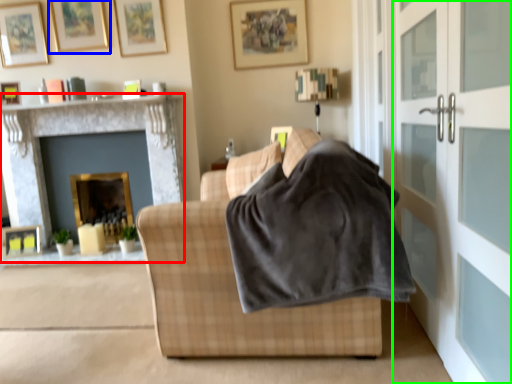
Question: Which object is positioned farthest from fireplace (highlighted by a red box)? Select from picture frame (highlighted by a blue box) and screen door (highlighted by a green box).

Choices:
 (A) picture frame
 (B) screen door

Answer: (B)